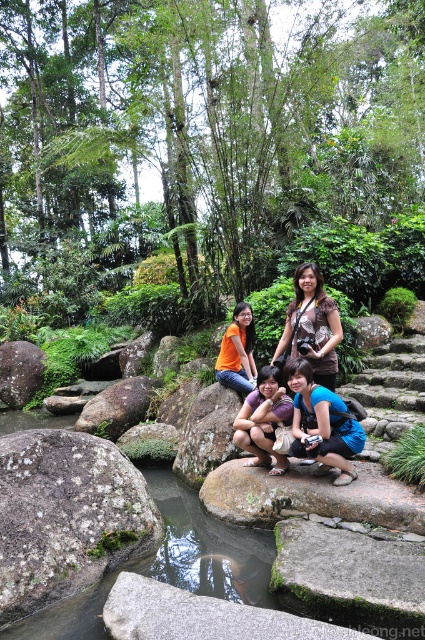
Is point (34, 464) behind point (158, 628)?

That is True.

The image size is (425, 640). I want to click on green mossy rock at center, so click(x=67, y=516).

Where is `green mossy rock at center`? The height and width of the screenshot is (640, 425). green mossy rock at center is located at coordinates [x=67, y=516].

Is green mossy stone at center wider than gray rough rock at center?

No, green mossy stone at center is not wider than gray rough rock at center.

Between green mossy stone at center and gray rough rock at center, which one appears on the left side from the viewer's perspective?

From the viewer's perspective, gray rough rock at center appears more on the left side.

Does point (399, 588) lie in front of point (104, 401)?

Yes, it is in front of point (104, 401).

What are the coordinates of `green mossy stone at center` in the screenshot? It's located at (348, 576).

Which is more to the left, green mossy stone at center or purple fabric shirt at center?

purple fabric shirt at center is more to the left.

Is green mossy stone at center further to camera compared to purple fabric shirt at center?

No, it is in front of purple fabric shirt at center.

Find the location of a particular element. green mossy stone at center is located at coordinates (348, 576).